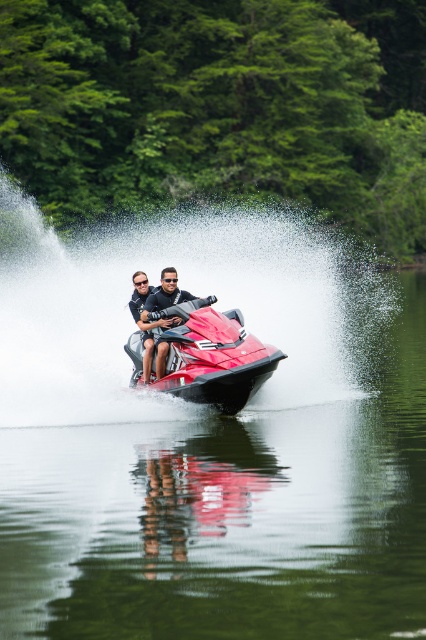
Looking at this image, you are a GPS navigator and need to locate the clear water at jet ski center in the image. What are its coordinates?

The clear water at jet ski center is located at coordinates point [230,512].

You are a photographer trying to capture the two jet skis in the scene. You know that the shiny red jet ski at center and the shiny metallic jet ski at center are both in the water. Which one is wider?

The shiny red jet ski at center is wider than the shiny metallic jet ski at center.